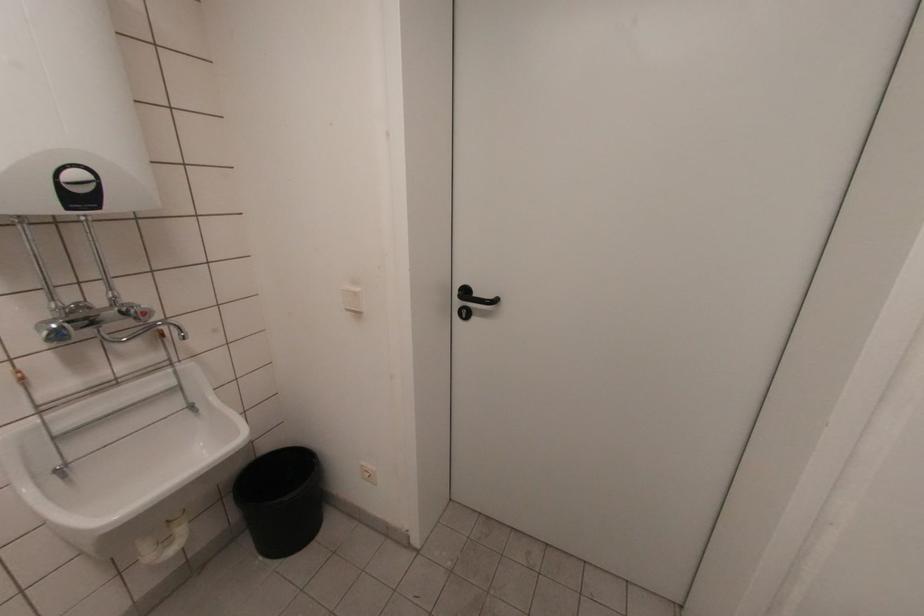
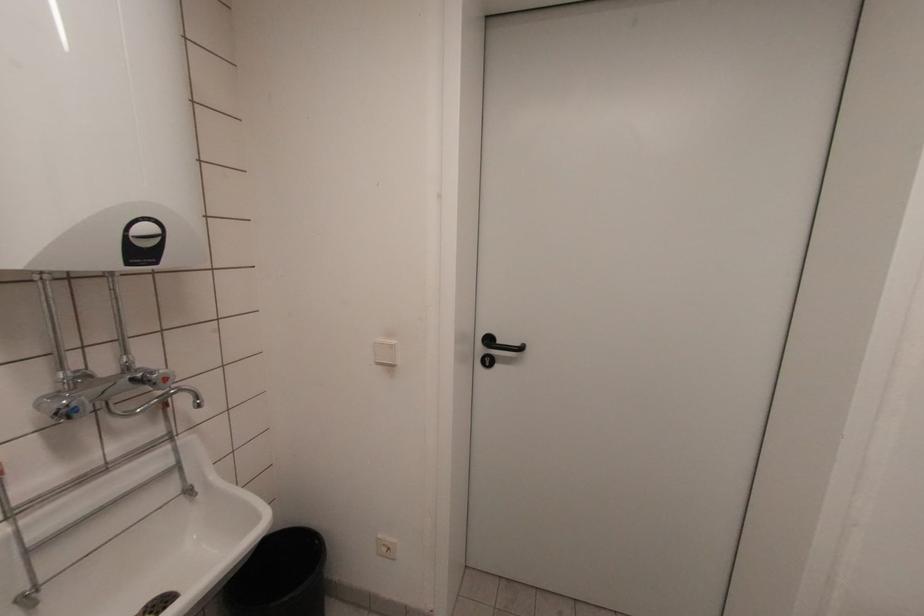
Question: The camera is either moving clockwise (left) or counter-clockwise (right) around the object. The first image is from the beginning of the video and the second image is from the end. Is the camera moving left or right when shooting the video?

Choices:
 (A) Left
 (B) Right

Answer: (A)